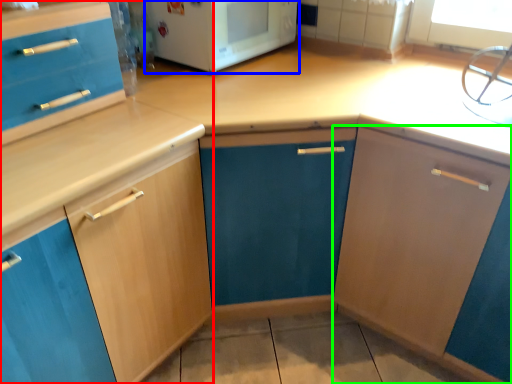
Question: Based on their relative distances, which object is nearer to cabinetry (highlighted by a red box)? Choose from home appliance (highlighted by a blue box) and cabinetry (highlighted by a green box).

Choices:
 (A) home appliance
 (B) cabinetry

Answer: (A)